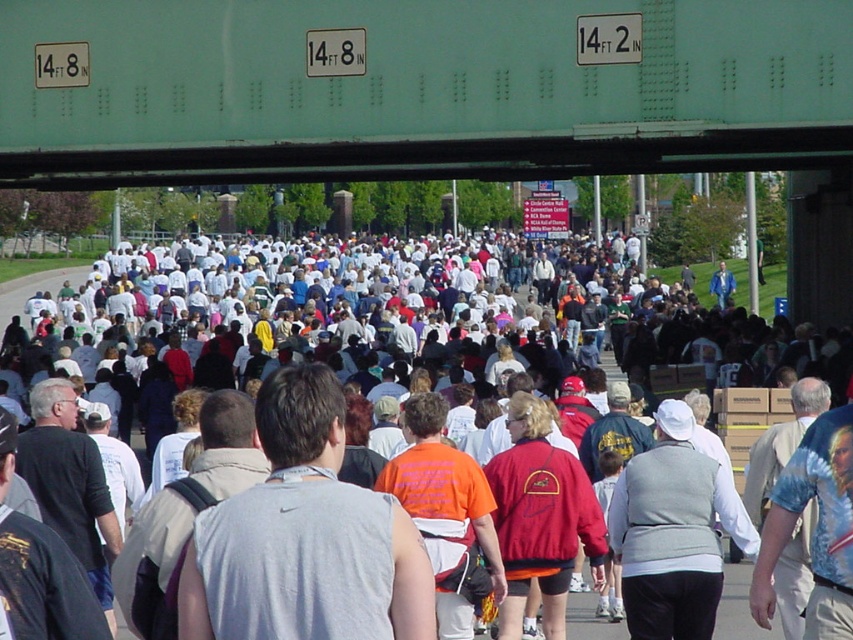
Can you confirm if teal metal bridge at upper center is bigger than gray sleeveless shirt at center?

Yes, teal metal bridge at upper center is bigger than gray sleeveless shirt at center.

Who is lower down, teal metal bridge at upper center or gray sleeveless shirt at center?

gray sleeveless shirt at center is lower down.

Consider the image. Who is more distant from viewer, (602, 161) or (325, 492)?

The point (602, 161) is behind.

What are the coordinates of `teal metal bridge at upper center` in the screenshot? It's located at (416, 88).

Is white cotton crowd at center positioned behind gray sleeveless shirt at center?

Yes, white cotton crowd at center is behind gray sleeveless shirt at center.

Can you confirm if white cotton crowd at center is smaller than gray sleeveless shirt at center?

Incorrect, white cotton crowd at center is not smaller in size than gray sleeveless shirt at center.

Is point (700, 413) in front of point (241, 608)?

No, it is behind (241, 608).

I want to click on white cotton crowd at center, so click(x=717, y=371).

Can you confirm if teal metal bridge at upper center is thinner than white cotton crowd at center?

Indeed, teal metal bridge at upper center has a lesser width compared to white cotton crowd at center.

Is teal metal bridge at upper center positioned before white cotton crowd at center?

That is False.

Between point (712, 170) and point (735, 422), which one is positioned behind?

Positioned behind is point (712, 170).

Locate an element on the screen. Image resolution: width=853 pixels, height=640 pixels. teal metal bridge at upper center is located at coordinates (416, 88).